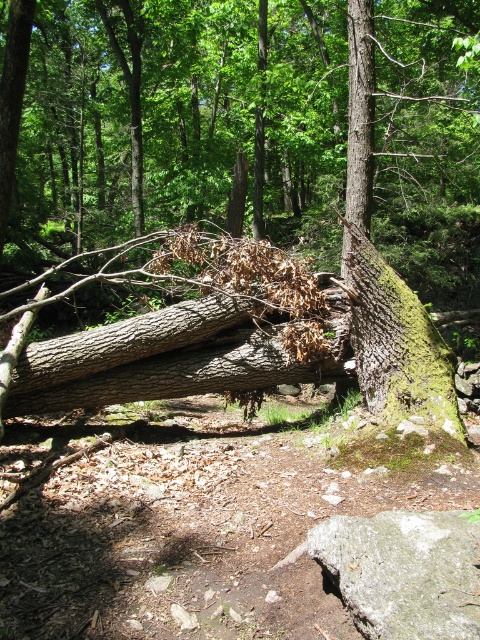
Looking at this image, you are a hiker trying to cross the rocky path in the forest. You see the gray rough rock at lower right and the green mossy tree trunk at center. Which object should you avoid stepping on to stay on the path?

You should avoid stepping on the green mossy tree trunk at center because the gray rough rock at lower right is in front of it, meaning the trunk is further back and not part of the path.

You are a hiker carrying a backpack and need to cross the rocky path. There is a gray rough rock at lower right and a green mossy tree trunk at center. Can you step over the gap between them?

The distance between the gray rough rock at lower right and green mossy tree trunk at center is 4.62 feet. Since this gap is wider than an average person can step over, you may need to find another way around or use the tree trunk as a handhold to navigate safely.